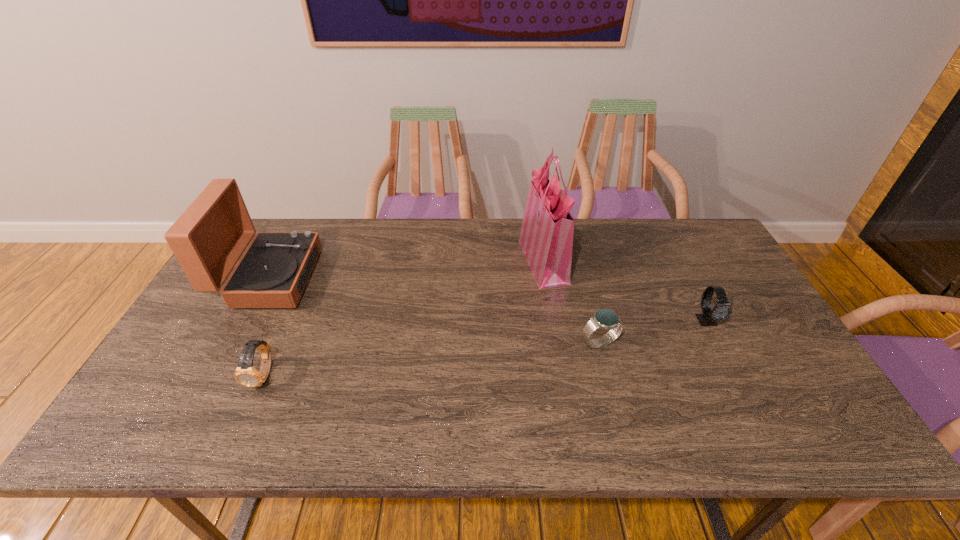
The image size is (960, 540). I want to click on blank space located on the face of the farthest watch, so click(x=724, y=354).

What are the coordinates of `vacant space located on the face of the leftmost watch` in the screenshot? It's located at (246, 416).

You are a GUI agent. You are given a task and a screenshot of the screen. Output one action in this format:
    pyautogui.click(x=<x>, y=<y>)
    Task: Click on the vacant space positioned on the right of the second nearest watch
    
    Given the screenshot: What is the action you would take?
    pyautogui.click(x=755, y=343)

At what (x,y) coordinates should I click in order to perform the action: click on shopping bag that is at the far edge. Please return your answer as a coordinate pair (x, y). This screenshot has width=960, height=540. Looking at the image, I should click on (546, 237).

You are a GUI agent. You are given a task and a screenshot of the screen. Output one action in this format:
    pyautogui.click(x=<x>, y=<y>)
    Task: Click on the phonograph record that is at the far edge
    This screenshot has height=540, width=960.
    Given the screenshot: What is the action you would take?
    pyautogui.click(x=208, y=239)

At what (x,y) coordinates should I click in order to perform the action: click on object situated at the left edge. Please return your answer as a coordinate pair (x, y). This screenshot has height=540, width=960. Looking at the image, I should click on (208, 239).

Where is `object that is at the right edge`? Image resolution: width=960 pixels, height=540 pixels. object that is at the right edge is located at coordinates (722, 310).

The image size is (960, 540). In order to click on object present at the far left corner in this screenshot , I will do `click(208, 239)`.

Image resolution: width=960 pixels, height=540 pixels. Identify the location of free space at the far edge of the desktop. (496, 246).

The image size is (960, 540). What are the coordinates of `vacant space at the near edge of the desktop` in the screenshot? It's located at (759, 421).